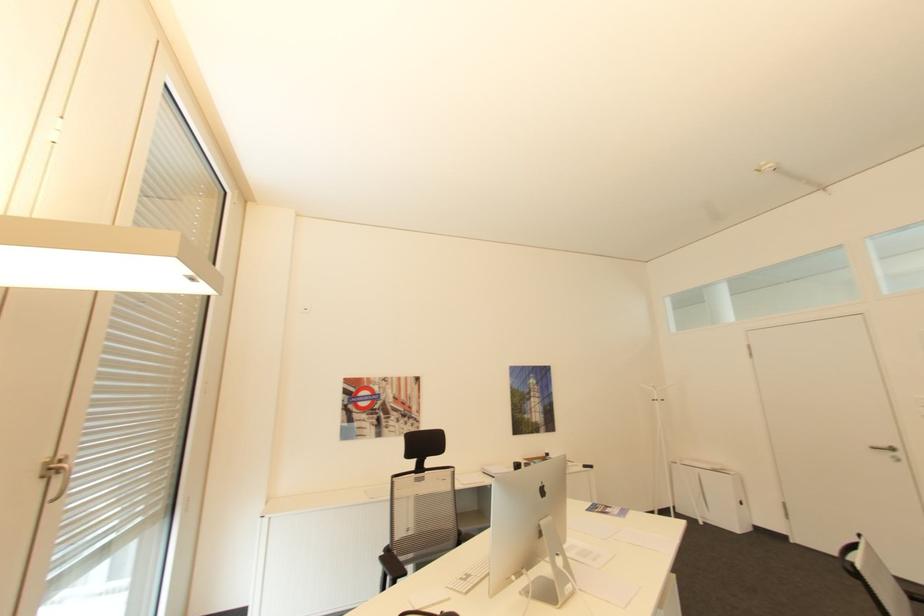
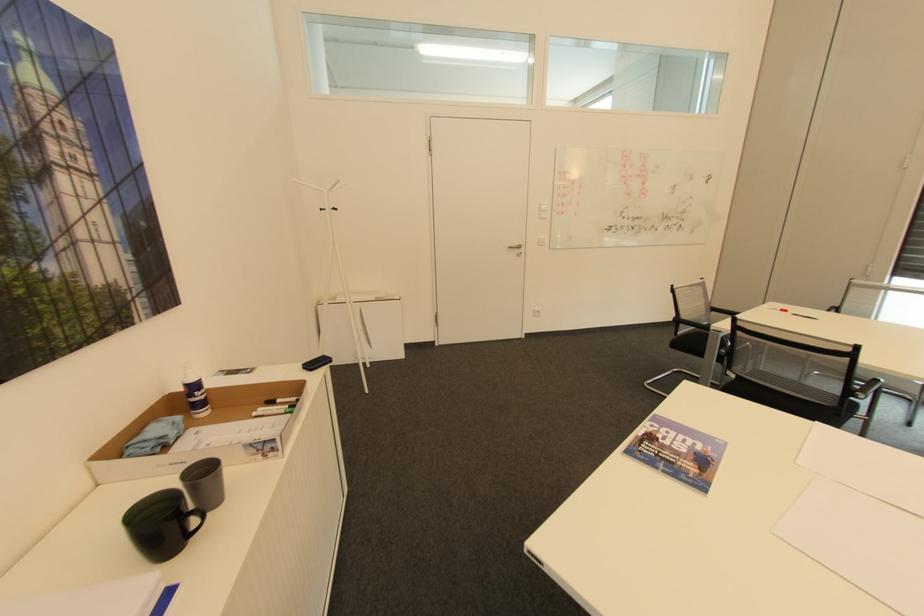
The point at (663, 399) is marked in the first image. Where is the corresponding point in the second image?

(333, 208)